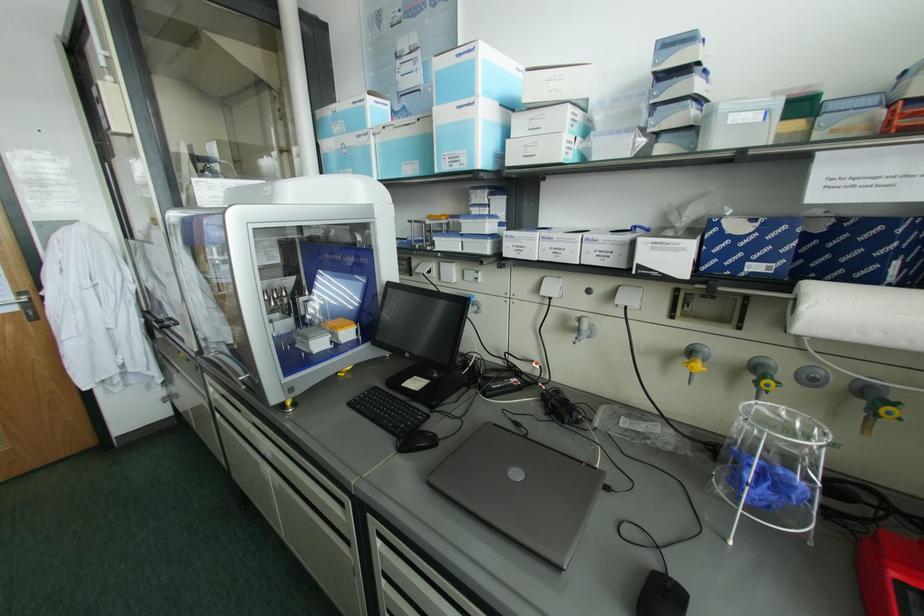
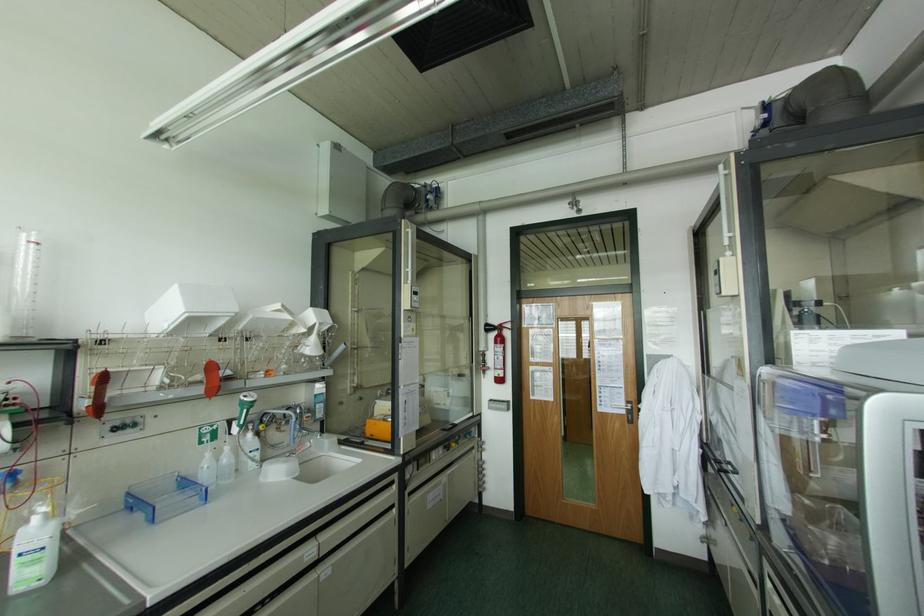
Question: The images are taken continuously from a first-person perspective. In which direction is your viewpoint rotating?

Choices:
 (A) Left
 (B) Right
 (C) Up
 (D) Down

Answer: (A)